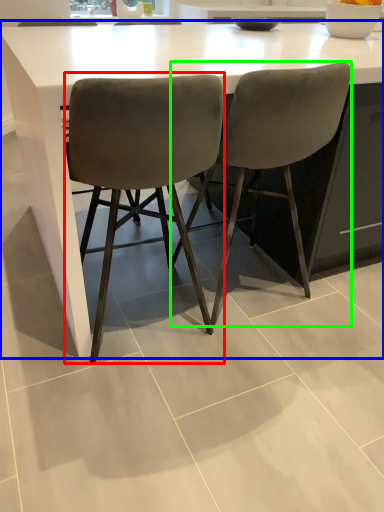
Question: Considering the real-world distances, which object is closest to chair (highlighted by a red box)? table (highlighted by a blue box) or chair (highlighted by a green box).

Choices:
 (A) table
 (B) chair

Answer: (B)